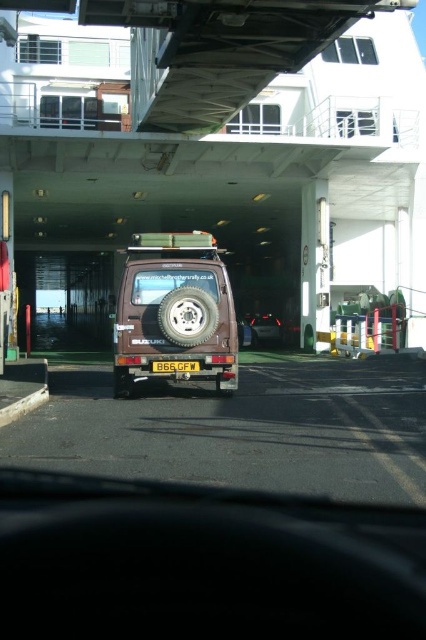
Question: Based on their relative distances, which object is nearer to the matte brown van at center?

Choices:
 (A) yellow matte license plate at center
 (B) brown matte jeep at center

Answer: (A)

Question: Does brown matte jeep at center appear on the right side of matte brown van at center?

Choices:
 (A) yes
 (B) no

Answer: (B)

Question: Is brown matte jeep at center positioned at the back of yellow matte license plate at center?

Choices:
 (A) yes
 (B) no

Answer: (A)

Question: Among these objects, which one is nearest to the camera?

Choices:
 (A) matte brown van at center
 (B) yellow matte license plate at center
 (C) brown matte jeep at center

Answer: (B)

Question: Which object is the farthest from the yellow matte license plate at center?

Choices:
 (A) brown matte jeep at center
 (B) matte brown van at center

Answer: (B)

Question: Considering the relative positions of matte brown van at center and yellow matte license plate at center in the image provided, where is matte brown van at center located with respect to yellow matte license plate at center?

Choices:
 (A) below
 (B) above

Answer: (B)